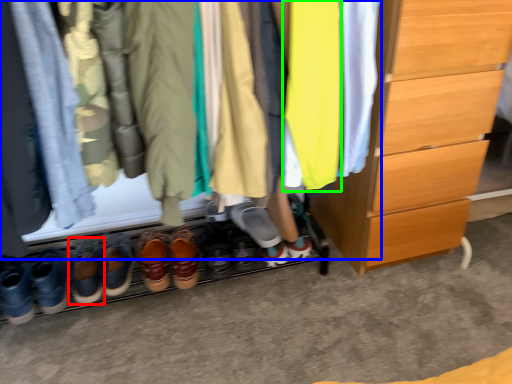
Question: Which is nearer to the footwear (highlighted by a red box)? closet (highlighted by a blue box) or clothing (highlighted by a green box).

Choices:
 (A) closet
 (B) clothing

Answer: (A)